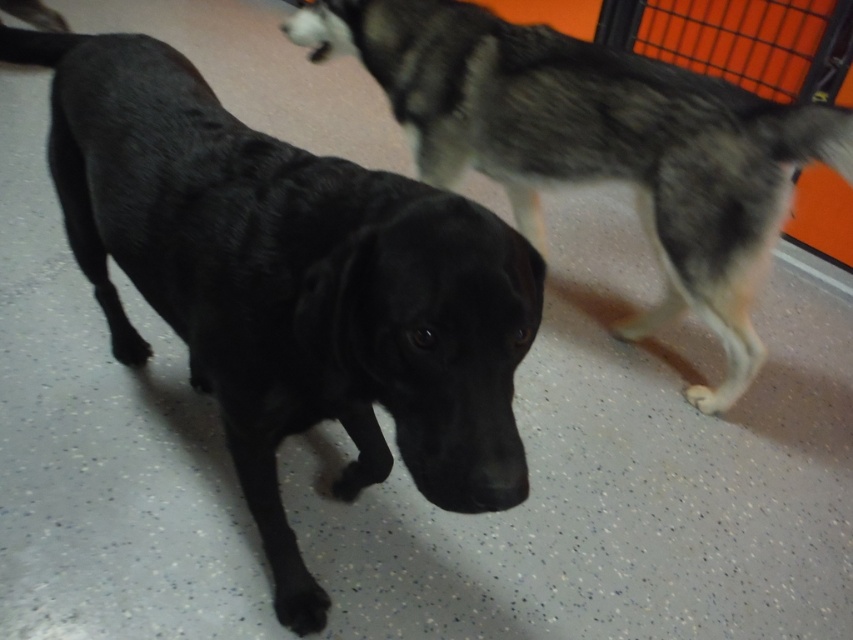
Between black matte dog at center and black fur dog at center, which one is positioned higher?

black fur dog at center is higher up.

Does black matte dog at center have a greater width compared to black fur dog at center?

No, black matte dog at center is not wider than black fur dog at center.

Who is more forward, (126, 326) or (752, 282)?

Point (752, 282) is more forward.

Identify the location of black matte dog at center. This screenshot has height=640, width=853. (291, 285).